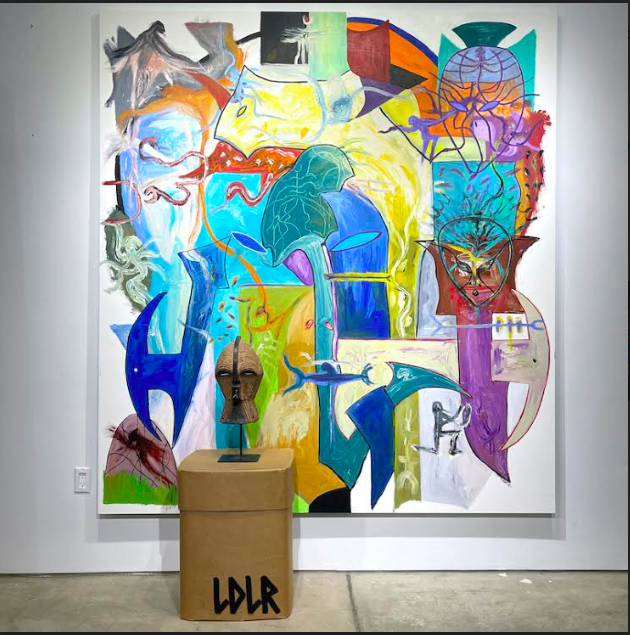
The width and height of the screenshot is (630, 635). What are the coordinates of `wall` in the screenshot? It's located at (604, 168).